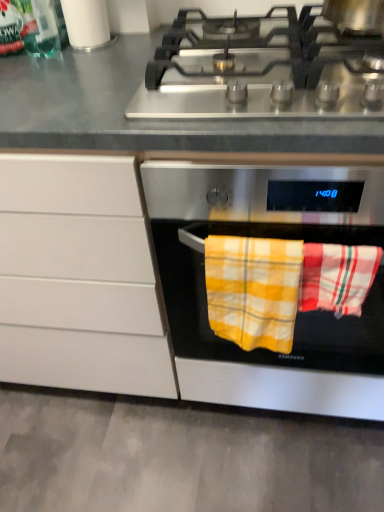
Question: Is white paper towel at upper left oriented away from white matte cabinet at center?

Choices:
 (A) no
 (B) yes

Answer: (A)

Question: From the image's perspective, is white paper towel at upper left over white matte cabinet at center?

Choices:
 (A) yes
 (B) no

Answer: (A)

Question: Is there a large distance between white paper towel at upper left and white matte cabinet at center?

Choices:
 (A) no
 (B) yes

Answer: (A)

Question: Is white paper towel at upper left facing towards white matte cabinet at center?

Choices:
 (A) no
 (B) yes

Answer: (A)

Question: Is white paper towel at upper left at the left side of white matte cabinet at center?

Choices:
 (A) no
 (B) yes

Answer: (A)

Question: Can you confirm if white paper towel at upper left is thinner than white matte cabinet at center?

Choices:
 (A) yes
 (B) no

Answer: (A)

Question: From the image's perspective, would you say stainless steel oven at center is shown under white matte cabinet at center?

Choices:
 (A) no
 (B) yes

Answer: (A)

Question: Is stainless steel oven at center in front of white matte cabinet at center?

Choices:
 (A) yes
 (B) no

Answer: (A)

Question: Does stainless steel oven at center have a greater height compared to white matte cabinet at center?

Choices:
 (A) yes
 (B) no

Answer: (B)

Question: From the image's perspective, is stainless steel oven at center on white matte cabinet at center?

Choices:
 (A) yes
 (B) no

Answer: (A)

Question: From a real-world perspective, is stainless steel oven at center on top of white matte cabinet at center?

Choices:
 (A) no
 (B) yes

Answer: (B)

Question: Can you confirm if stainless steel oven at center is thinner than white matte cabinet at center?

Choices:
 (A) yes
 (B) no

Answer: (A)

Question: Is stainless steel gas stove at upper center closer to the viewer compared to yellow plaid towel at center, which is the 2th beach towel from right to left?

Choices:
 (A) yes
 (B) no

Answer: (A)